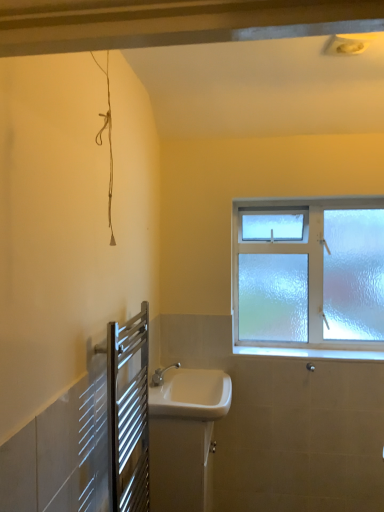
Question: Is white ceramic sink at center, which is counted as the 1th sink, starting from the top, outside white glossy sink at lower center, the 2th sink viewed from the top?

Choices:
 (A) no
 (B) yes

Answer: (B)

Question: Is white ceramic sink at center, marked as the second sink in a bottom-to-top arrangement, to the left of white glossy sink at lower center, the first sink ordered from the bottom, from the viewer's perspective?

Choices:
 (A) no
 (B) yes

Answer: (A)

Question: Is white ceramic sink at center, marked as the second sink in a bottom-to-top arrangement, in front of white glossy sink at lower center, the first sink ordered from the bottom?

Choices:
 (A) no
 (B) yes

Answer: (B)

Question: Is white ceramic sink at center, which is counted as the 1th sink, starting from the top, wider than white glossy sink at lower center, the first sink ordered from the bottom?

Choices:
 (A) yes
 (B) no

Answer: (A)

Question: From a real-world perspective, is white ceramic sink at center, marked as the second sink in a bottom-to-top arrangement, beneath white glossy sink at lower center, the 2th sink viewed from the top?

Choices:
 (A) no
 (B) yes

Answer: (A)

Question: Considering the positions of silver metallic towel rack at lower left and white glossy sink at lower center, the 2th sink viewed from the top, in the image, is silver metallic towel rack at lower left bigger or smaller than white glossy sink at lower center, the 2th sink viewed from the top,?

Choices:
 (A) big
 (B) small

Answer: (B)

Question: Does point (125, 422) appear closer or farther from the camera than point (195, 378)?

Choices:
 (A) farther
 (B) closer

Answer: (B)

Question: Based on their positions, is silver metallic towel rack at lower left located to the left or right of white glossy sink at lower center, the first sink ordered from the bottom?

Choices:
 (A) left
 (B) right

Answer: (A)

Question: Looking at their shapes, would you say silver metallic towel rack at lower left is wider or thinner than white glossy sink at lower center, the first sink ordered from the bottom?

Choices:
 (A) wide
 (B) thin

Answer: (B)

Question: Choose the correct answer: Is frosted glass window at upper right inside white ceramic sink at center, which is counted as the 1th sink, starting from the top, or outside it?

Choices:
 (A) inside
 (B) outside

Answer: (B)

Question: Is frosted glass window at upper right to the left or to the right of white ceramic sink at center, which is counted as the 1th sink, starting from the top, in the image?

Choices:
 (A) right
 (B) left

Answer: (A)

Question: From their relative heights in the image, would you say frosted glass window at upper right is taller or shorter than white ceramic sink at center, which is counted as the 1th sink, starting from the top?

Choices:
 (A) tall
 (B) short

Answer: (A)

Question: In terms of size, does frosted glass window at upper right appear bigger or smaller than white ceramic sink at center, marked as the second sink in a bottom-to-top arrangement?

Choices:
 (A) big
 (B) small

Answer: (A)

Question: Relative to frosted glass window at upper right, is white glossy sink at lower center, the first sink ordered from the bottom, in front or behind?

Choices:
 (A) front
 (B) behind

Answer: (A)

Question: From the image's perspective, relative to frosted glass window at upper right, is white glossy sink at lower center, the 2th sink viewed from the top, above or below?

Choices:
 (A) above
 (B) below

Answer: (B)